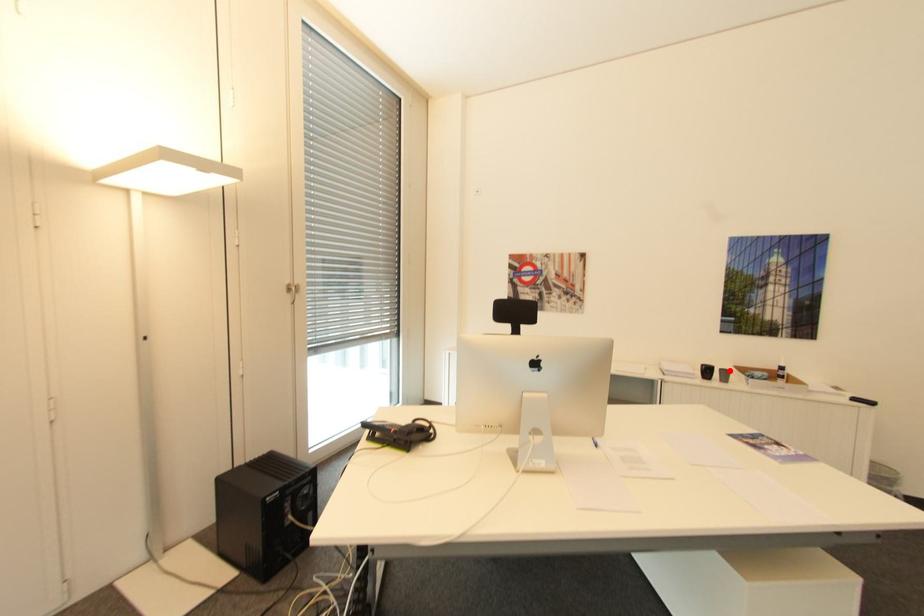
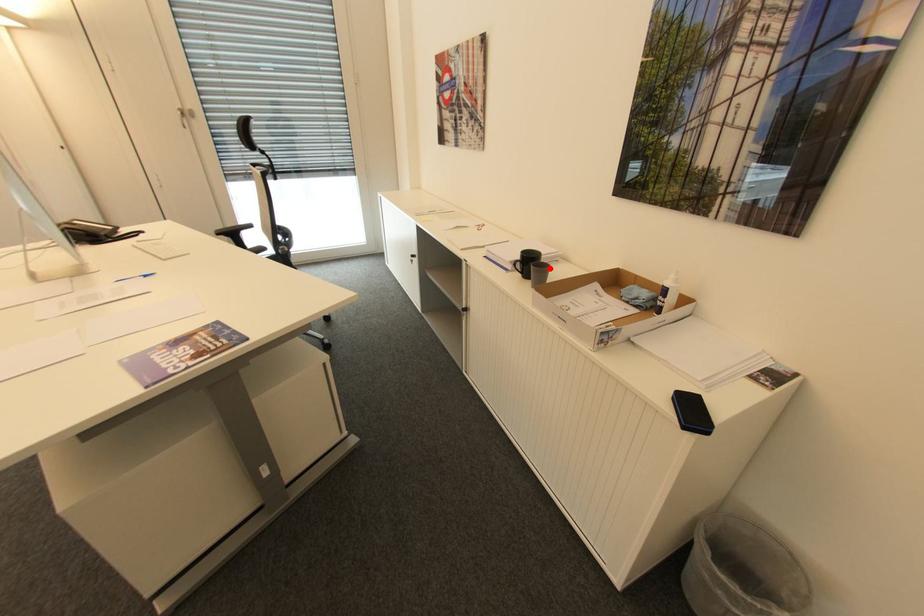
I am providing you with two images of the same scene from different viewpoints. A red point is marked on the first image and another point is marked on the second image. Are the points marked in image1 and image2 representing the same 3D position?

Yes